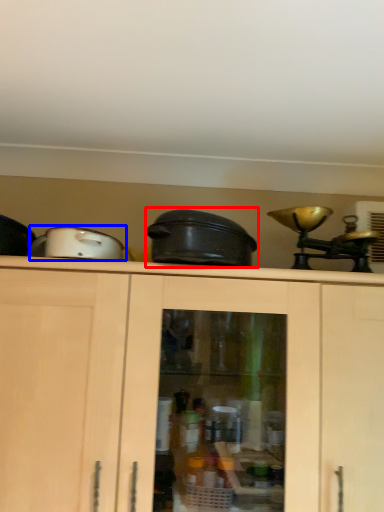
Question: Which object appears closest to the camera in this image, crock pot (highlighted by a red box) or appliance (highlighted by a blue box)?

Choices:
 (A) crock pot
 (B) appliance

Answer: (B)